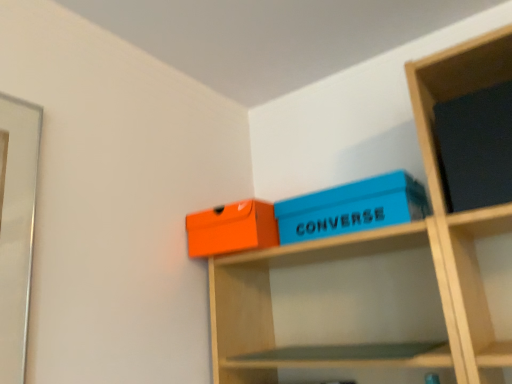
Question: Are blue matte shoebox at upper center, which ranks as the first box in right-to-left order, and matte orange box at upper center, arranged as the second box when viewed from the right, far apart?

Choices:
 (A) no
 (B) yes

Answer: (A)

Question: Is blue matte shoebox at upper center, which ranks as the first box in right-to-left order, touching matte orange box at upper center, arranged as the second box when viewed from the right?

Choices:
 (A) yes
 (B) no

Answer: (B)

Question: Is the depth of blue matte shoebox at upper center, which is counted as the 2th box, starting from the left, less than that of matte orange box at upper center, arranged as the second box when viewed from the right?

Choices:
 (A) yes
 (B) no

Answer: (A)

Question: Is blue matte shoebox at upper center, which ranks as the first box in right-to-left order, wider than matte orange box at upper center, arranged as the second box when viewed from the right?

Choices:
 (A) no
 (B) yes

Answer: (B)

Question: Would you say blue matte shoebox at upper center, which ranks as the first box in right-to-left order, is outside matte orange box at upper center, arranged as the second box when viewed from the right?

Choices:
 (A) yes
 (B) no

Answer: (A)

Question: From the image's perspective, would you say blue matte shoebox at upper center, which is counted as the 2th box, starting from the left, is shown under matte orange box at upper center, the 1th box viewed from the left?

Choices:
 (A) no
 (B) yes

Answer: (A)

Question: Is blue matte shoebox at upper center, which ranks as the first box in right-to-left order, completely or partially inside matte orange box at upper center, the 1th box viewed from the left?

Choices:
 (A) yes
 (B) no

Answer: (B)

Question: Does matte orange box at upper center, the 1th box viewed from the left, appear on the left side of blue matte shoebox at upper center, which is counted as the 2th box, starting from the left?

Choices:
 (A) no
 (B) yes

Answer: (B)

Question: Is matte orange box at upper center, arranged as the second box when viewed from the right, at the right side of blue matte shoebox at upper center, which ranks as the first box in right-to-left order?

Choices:
 (A) yes
 (B) no

Answer: (B)

Question: Are matte orange box at upper center, arranged as the second box when viewed from the right, and blue matte shoebox at upper center, which ranks as the first box in right-to-left order, located far from each other?

Choices:
 (A) no
 (B) yes

Answer: (A)

Question: Can you confirm if matte orange box at upper center, the 1th box viewed from the left, is taller than blue matte shoebox at upper center, which ranks as the first box in right-to-left order?

Choices:
 (A) no
 (B) yes

Answer: (B)

Question: Is matte orange box at upper center, arranged as the second box when viewed from the right, positioned with its back to blue matte shoebox at upper center, which ranks as the first box in right-to-left order?

Choices:
 (A) yes
 (B) no

Answer: (B)

Question: From a real-world perspective, is matte orange box at upper center, the 1th box viewed from the left, located beneath matte black book at upper right?

Choices:
 (A) yes
 (B) no

Answer: (A)